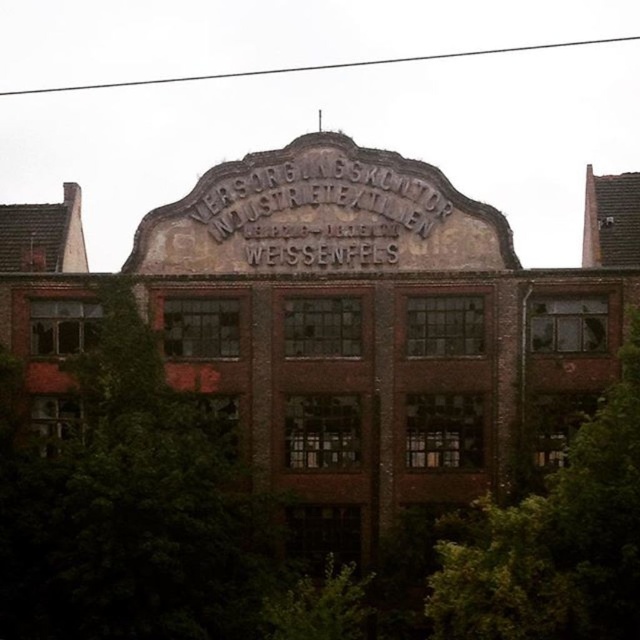
Question: Does green leafy tree at left have a smaller size compared to green leafy tree at center?

Choices:
 (A) yes
 (B) no

Answer: (B)

Question: Estimate the real-world distances between objects in this image. Which object is farther from the black metal sign at center?

Choices:
 (A) green leafy tree at center
 (B) green leafy tree at left

Answer: (A)

Question: Which is farther from the black metal sign at center?

Choices:
 (A) green leafy tree at left
 (B) green leafy tree at center

Answer: (B)

Question: Is green leafy tree at left smaller than green leafy tree at center?

Choices:
 (A) yes
 (B) no

Answer: (B)

Question: Does green leafy tree at left have a smaller size compared to black metal sign at center?

Choices:
 (A) no
 (B) yes

Answer: (A)

Question: Among these objects, which one is nearest to the camera?

Choices:
 (A) green leafy tree at center
 (B) green leafy tree at left

Answer: (A)